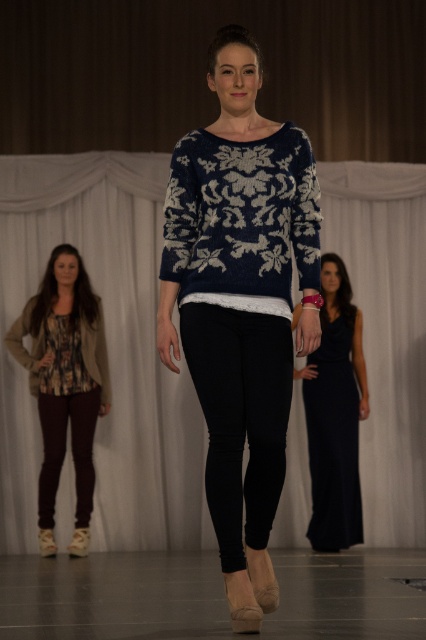
You are a fashion designer observing the runway show. You need to place a new accessory exactly at the same position as the navy knit sweater at center. What are the coordinates where you should place the accessory?

The navy knit sweater at center is located at coordinates point (241, 304), so you should place the accessory at point (241, 304).

You are a fashion designer observing the runway show. You need to decide which garment to place in a display case that can only accommodate items up to the width of the floral print jersey at lower left. Based on the scene, can the navy knit sweater at center fit in the case?

The navy knit sweater at center might be wider than the floral print jersey at lower left, so it may not fit in the display case designed for the floral print jersey at lower left.